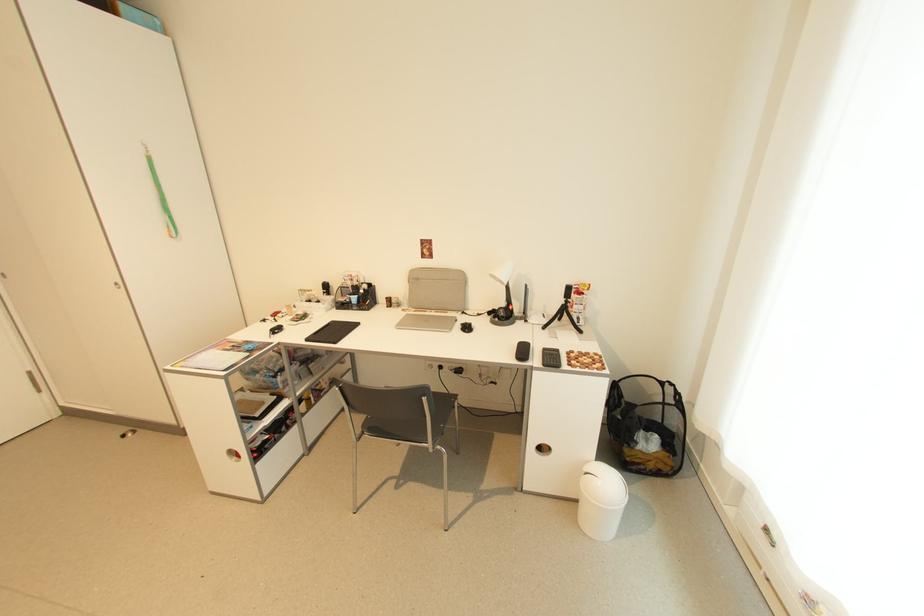
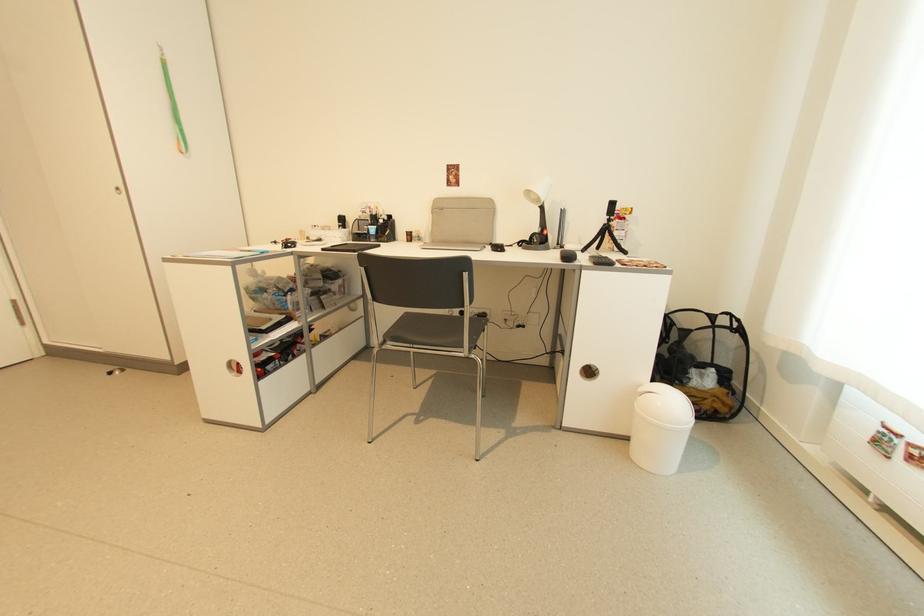
The point at (642, 450) is marked in the first image. Where is the corresponding point in the second image?

(697, 386)